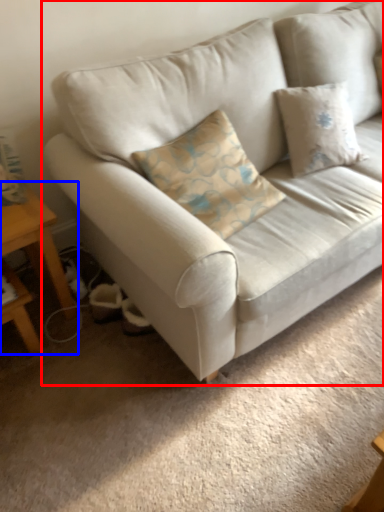
Question: Which object appears closest to the camera in this image, studio couch (highlighted by a red box) or table (highlighted by a blue box)?

Choices:
 (A) studio couch
 (B) table

Answer: (A)